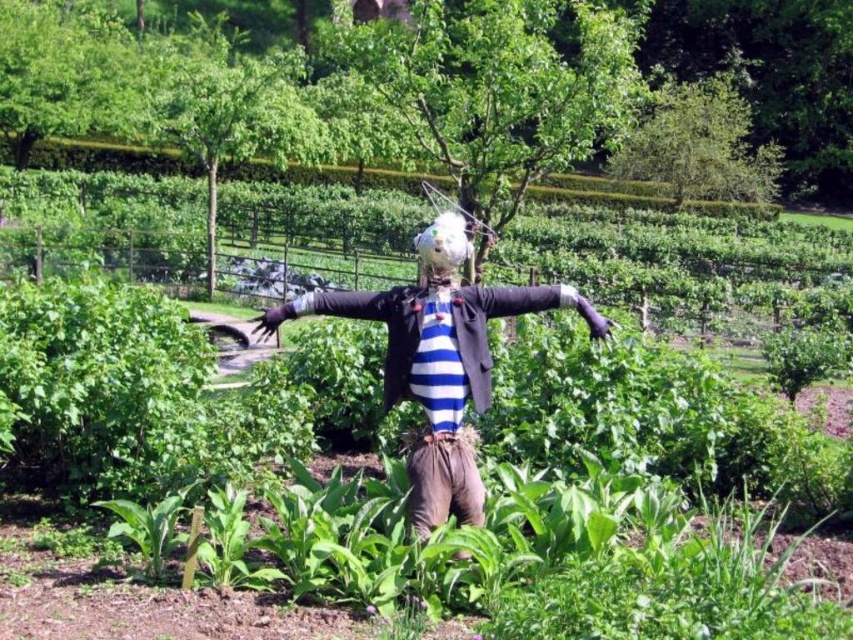
Consider the image. Between striped fabric scarecrow at center and white fabric head at center, which one is positioned lower?

Positioned lower is striped fabric scarecrow at center.

Does point (357, 316) lie in front of point (428, 232)?

No.

Locate an element on the screen. striped fabric scarecrow at center is located at coordinates (438, 371).